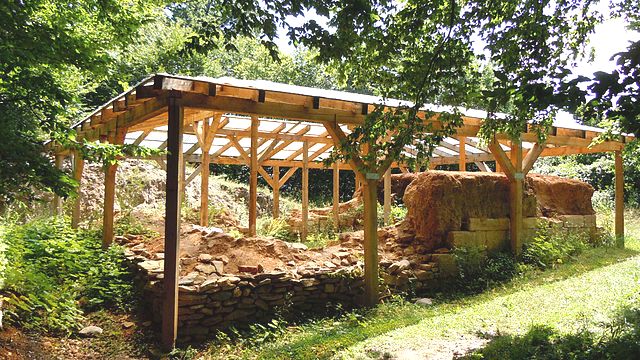
Identify the location of inside roof. This screenshot has width=640, height=360. (241, 123).